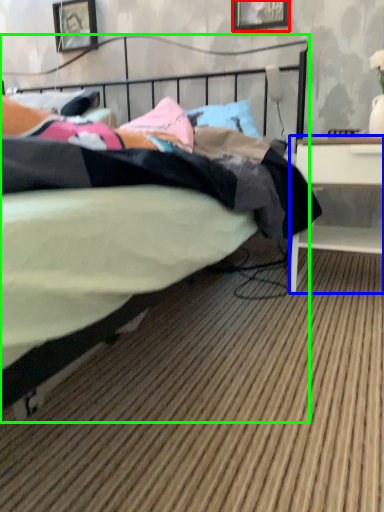
Question: Estimate the real-world distances between objects in this image. Which object is closer to picture frame (highlighted by a red box), desk (highlighted by a blue box) or bed (highlighted by a green box)?

Choices:
 (A) desk
 (B) bed

Answer: (A)